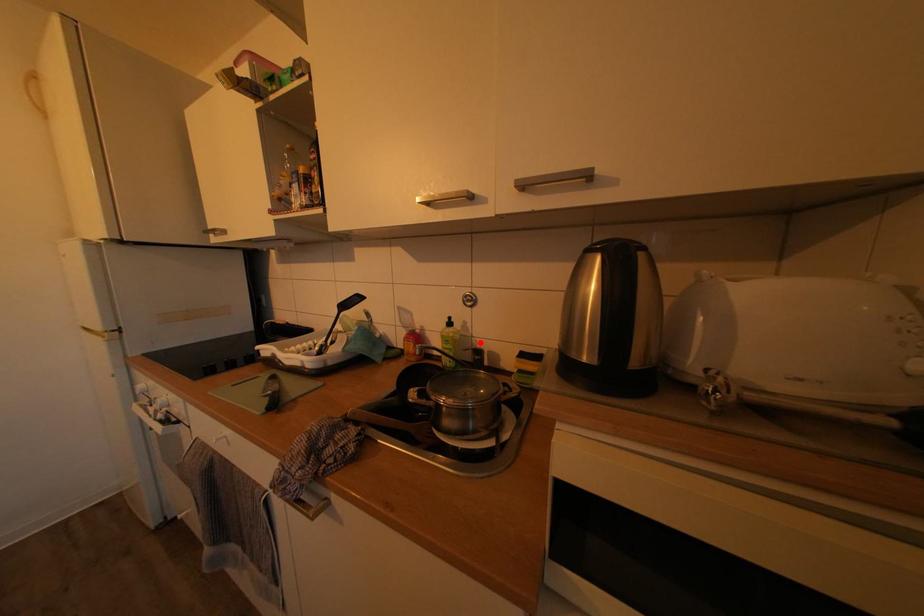
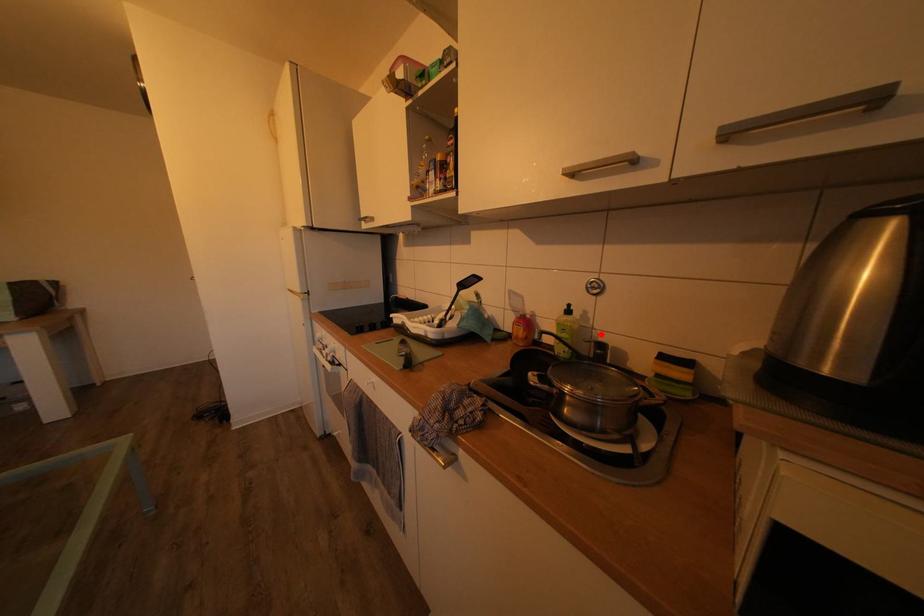
I am providing you with two images of the same scene from different viewpoints. A red point is marked on the first image and another point is marked on the second image. Is the red point in image1 aligned with the point shown in image2?

Yes